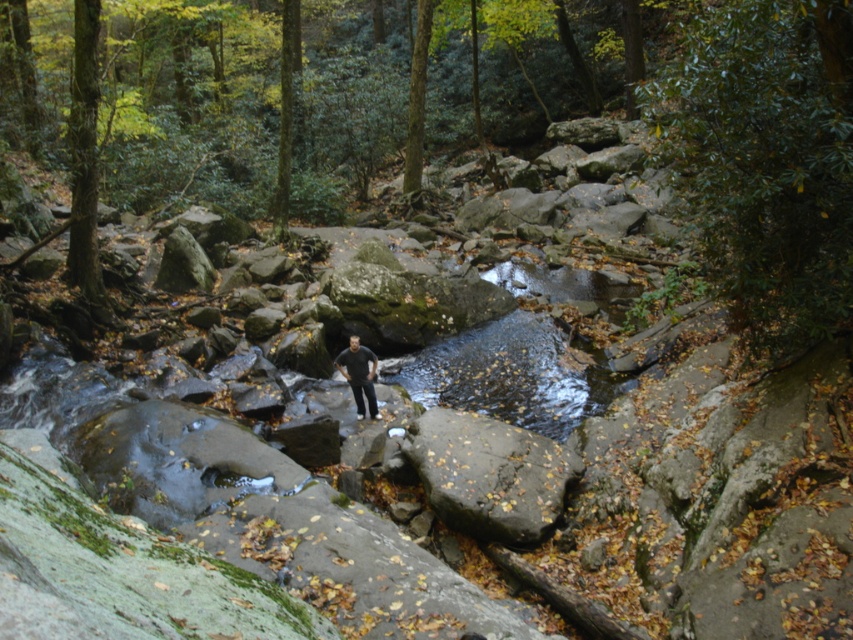
You are a hiker who wants to cross the stream. You see the clear water at center and the dark gray textured rock at center. Can you safely step from the rock to the water? Consider the distance between them.

The distance between the clear water at center and the dark gray textured rock at center is 10.64 feet. Since this distance is too large to jump safely, you should find another path or wait for a bridge.

You are a hiker who wants to sit on the green mossy rock at center. However, you are wearing the dark gray pants at center. Is the rock big enough to sit on comfortably without your pants getting wet?

The green mossy rock at center is larger in size than dark gray pants at center, so yes, the rock should be big enough to sit on comfortably without your pants getting wet.